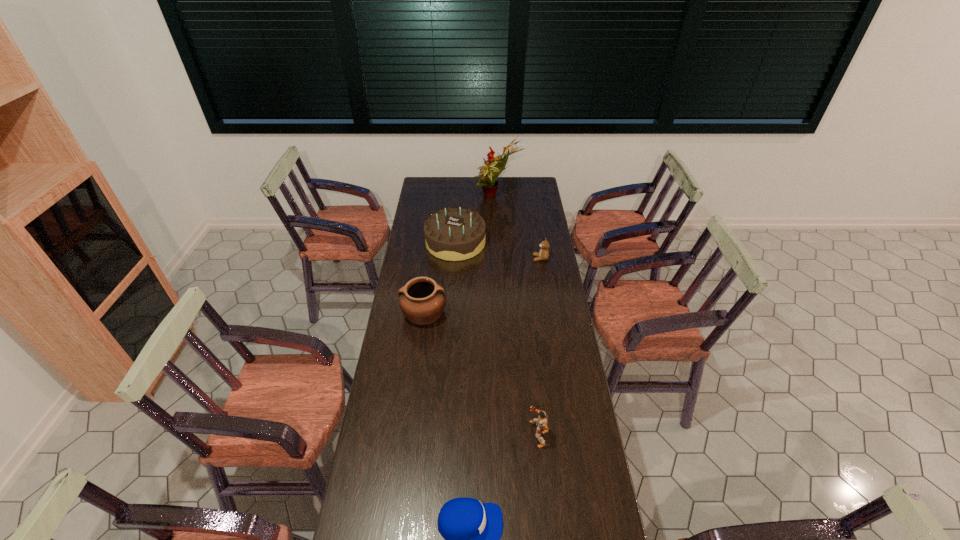
Where is `free space located 0.190m on the front-facing side of the birthday cake`? Image resolution: width=960 pixels, height=540 pixels. free space located 0.190m on the front-facing side of the birthday cake is located at coordinates (452, 288).

Locate an element on the screen. free space located on the right of the pottery is located at coordinates (468, 313).

Locate an element on the screen. This screenshot has width=960, height=540. free space located 0.190m on the front-facing side of the fifth farthest object is located at coordinates (474, 434).

Image resolution: width=960 pixels, height=540 pixels. What are the coordinates of `vacant region located 0.170m on the front-facing side of the fifth farthest object` in the screenshot? It's located at (480, 434).

Identify the location of vacant space located on the front-facing side of the fifth farthest object. (500, 434).

I want to click on vacant area situated 0.330m on the front-facing side of the fifth tallest object, so click(x=468, y=259).

Image resolution: width=960 pixels, height=540 pixels. In order to click on vacant space located on the front-facing side of the fifth tallest object in this screenshot , I will do `click(495, 259)`.

Locate an element on the screen. The width and height of the screenshot is (960, 540). free space located 0.160m on the front-facing side of the fifth tallest object is located at coordinates (501, 259).

Locate an element on the screen. The height and width of the screenshot is (540, 960). object that is at the far edge is located at coordinates (494, 166).

Locate an element on the screen. birthday cake that is at the left edge is located at coordinates (454, 234).